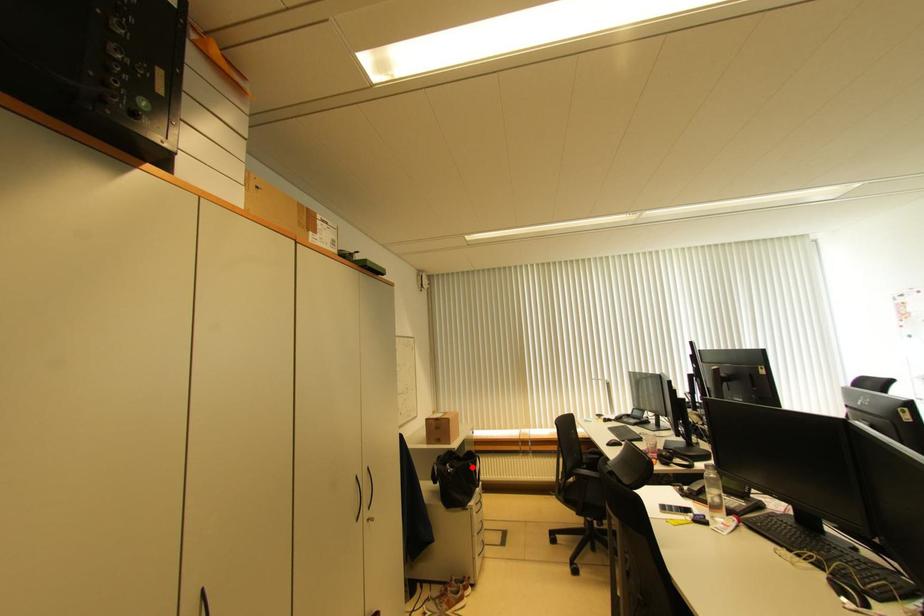
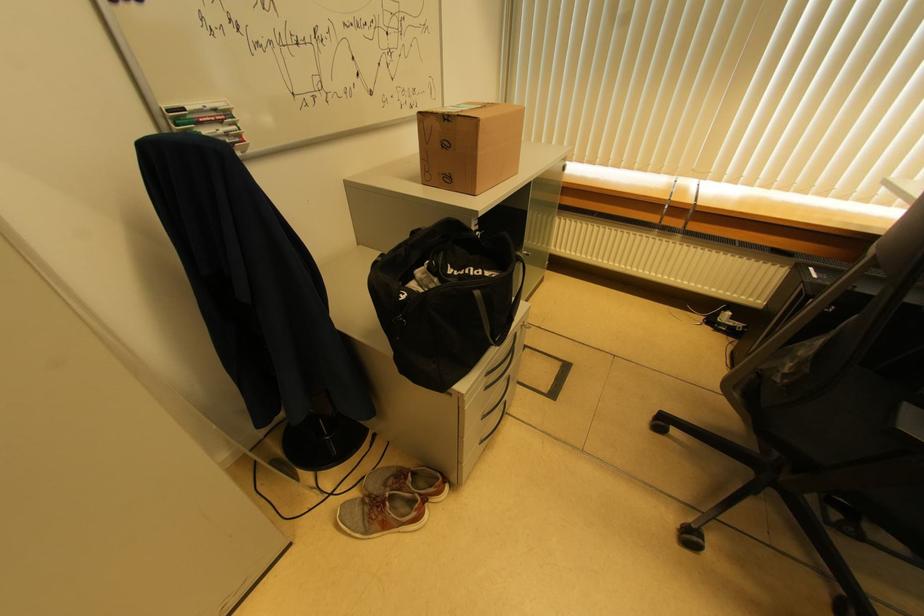
Question: I am providing you with two images of the same scene from different viewpoints. In image1, a red point is highlighted. Considering the same 3D point in image2, which of the following is correct?

Choices:
 (A) It is closer
 (B) It is farther

Answer: (B)